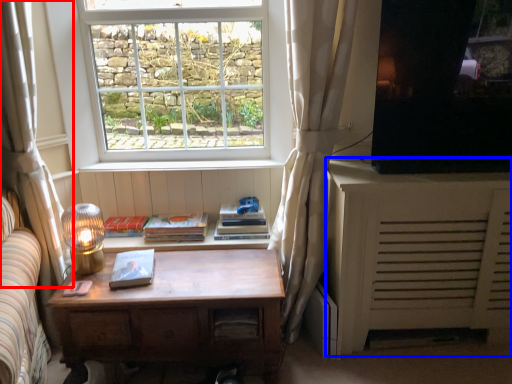
Question: Which point is further to the camera, curtain (highlighted by a red box) or cabinetry (highlighted by a blue box)?

Choices:
 (A) curtain
 (B) cabinetry

Answer: (B)